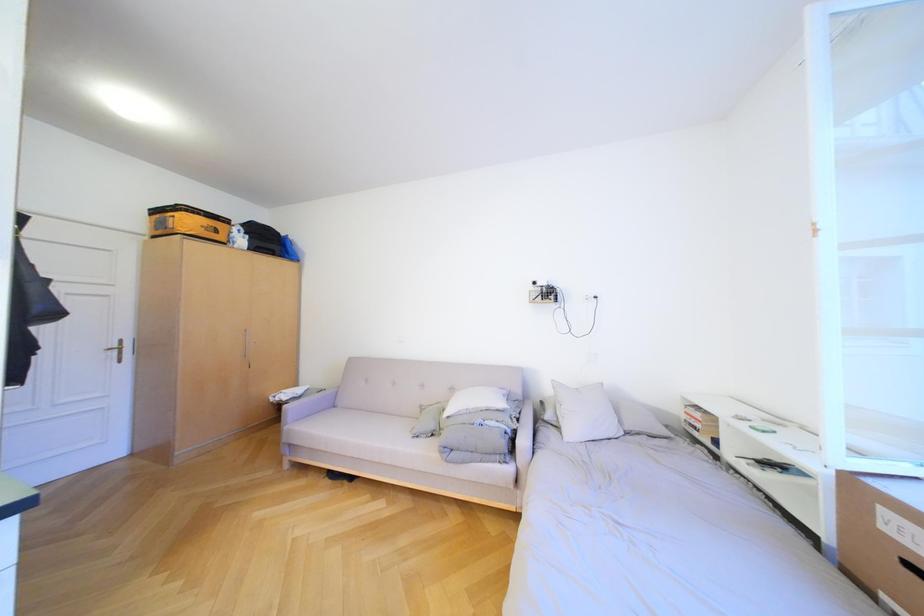
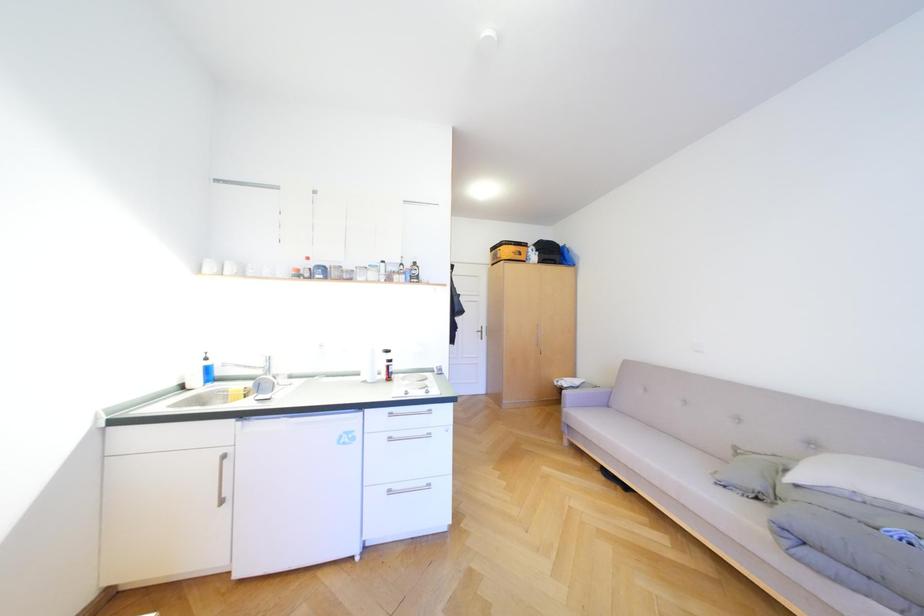
Question: The images are taken continuously from a first-person perspective. In which direction is your viewpoint rotating?

Choices:
 (A) Left
 (B) Right
 (C) Up
 (D) Down

Answer: (A)